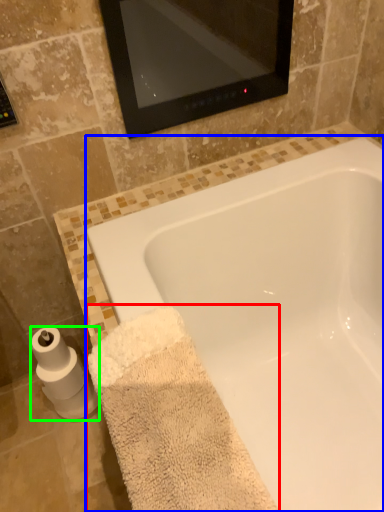
Question: Which object is the farthest from bath towel (highlighted by a red box)? Choose among these: bathtub (highlighted by a blue box) or toilet paper (highlighted by a green box).

Choices:
 (A) bathtub
 (B) toilet paper

Answer: (B)